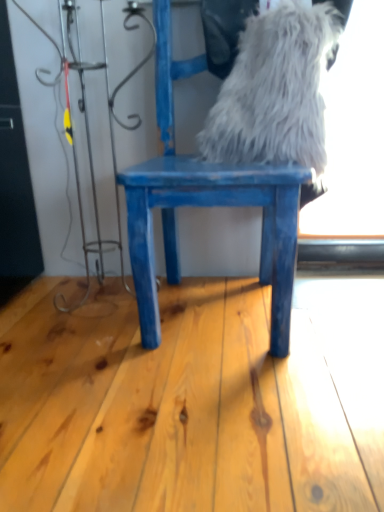
Question: From their relative heights in the image, would you say blue painted wood chair at center is taller or shorter than white fluffy fur at upper center?

Choices:
 (A) short
 (B) tall

Answer: (B)

Question: Does point (283, 352) appear closer or farther from the camera than point (299, 60)?

Choices:
 (A) farther
 (B) closer

Answer: (B)

Question: Is blue painted wood chair at center to the left or to the right of white fluffy fur at upper center in the image?

Choices:
 (A) right
 (B) left

Answer: (B)

Question: Considering the positions of point (316, 96) and point (276, 320), is point (316, 96) closer or farther from the camera than point (276, 320)?

Choices:
 (A) closer
 (B) farther

Answer: (B)

Question: Considering the relative positions of white fluffy fur at upper center and blue painted wood chair at center in the image provided, is white fluffy fur at upper center to the left or to the right of blue painted wood chair at center?

Choices:
 (A) left
 (B) right

Answer: (B)

Question: Looking at the image, does white fluffy fur at upper center seem bigger or smaller compared to blue painted wood chair at center?

Choices:
 (A) big
 (B) small

Answer: (B)

Question: Is white fluffy fur at upper center taller or shorter than blue painted wood chair at center?

Choices:
 (A) short
 (B) tall

Answer: (A)